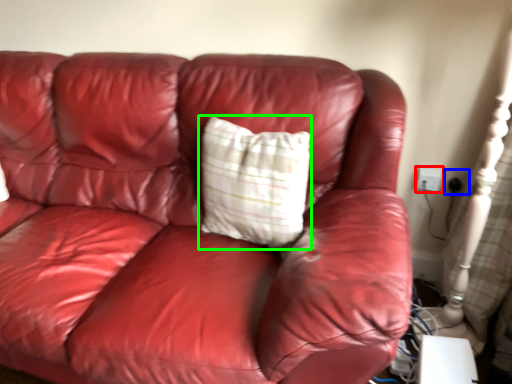
Question: Which object is positioned closest to electric outlet (highlighted by a red box)? Select from electric outlet (highlighted by a blue box) and pillow (highlighted by a green box).

Choices:
 (A) electric outlet
 (B) pillow

Answer: (A)